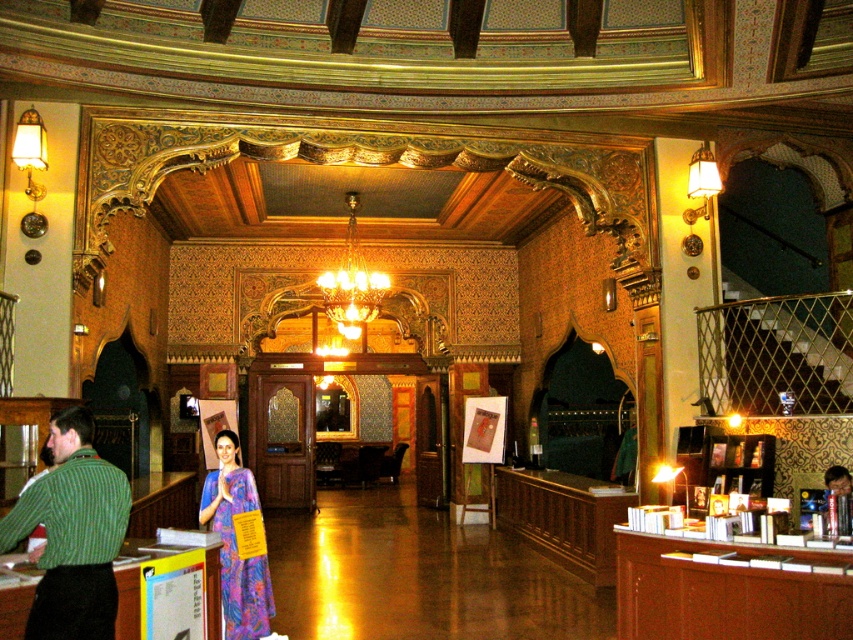
You are an interior designer planning to place a large sculpture in this grand building. The sculpture requires a space larger than the area occupied by the green knitted sweater at lower left. Can you place it near the crystal glass chandelier at center?

The green knitted sweater at lower left occupies less space than the crystal glass chandelier at center. Since the sculpture requires a space larger than the green knitted sweater at lower left, it can be placed near the crystal glass chandelier at center as it has a larger area available.